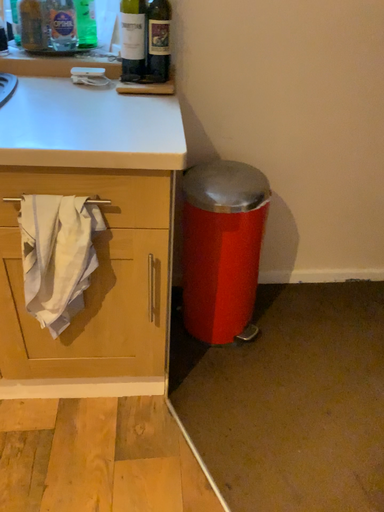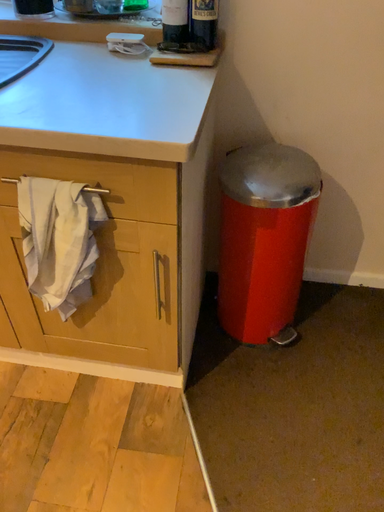
Question: Which way did the camera rotate in the video?

Choices:
 (A) rotated left
 (B) rotated right

Answer: (A)